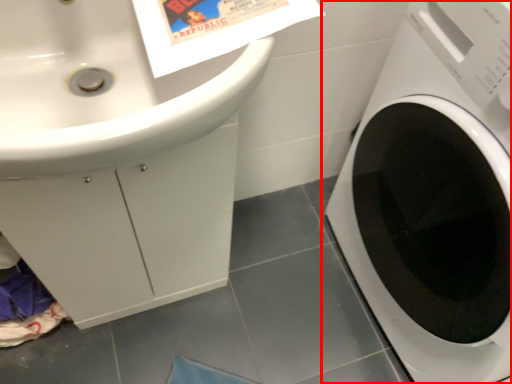
Question: From the image's perspective, what is the correct spatial positioning of washing machine (annotated by the red box) in reference to sink?

Choices:
 (A) below
 (B) above

Answer: (A)